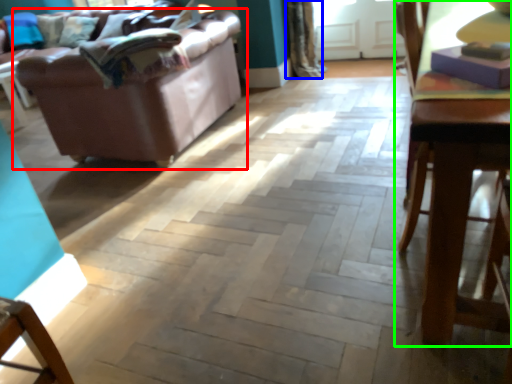
Question: Based on their relative distances, which object is farther from studio couch (highlighted by a red box)? Choose from curtain (highlighted by a blue box) and table (highlighted by a green box).

Choices:
 (A) curtain
 (B) table

Answer: (B)